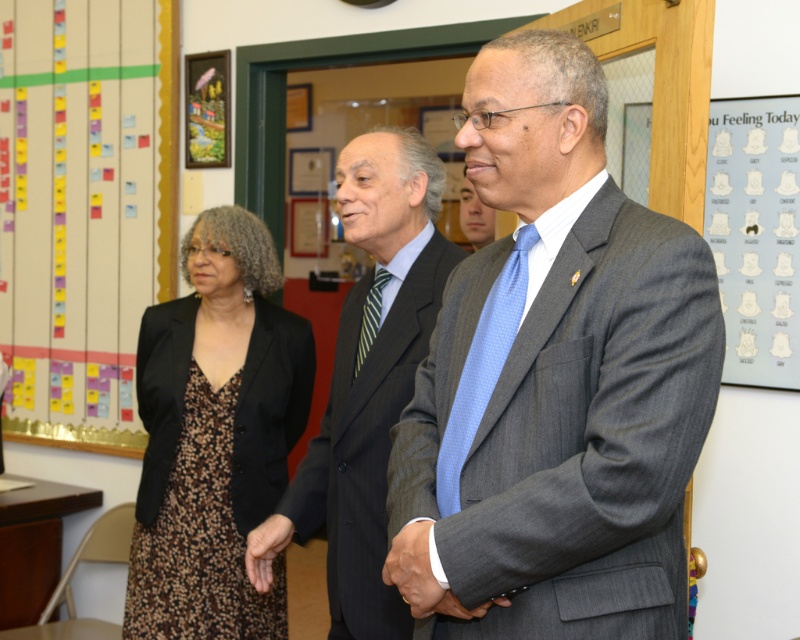
Question: Is gray suit at center to the right of leopard print dress at left from the viewer's perspective?

Choices:
 (A) no
 (B) yes

Answer: (B)

Question: Which point is closer to the camera?

Choices:
 (A) (328, 483)
 (B) (264, 540)
 (C) (376, 300)
 (D) (512, 81)

Answer: (D)

Question: Estimate the real-world distances between objects in this image. Which object is farther from the smooth skin hand at center?

Choices:
 (A) leather textured hand at center
 (B) leopard print dress at left

Answer: (B)

Question: Is gray suit at center above leopard print dress at left?

Choices:
 (A) yes
 (B) no

Answer: (A)

Question: Which object is closer to the camera taking this photo?

Choices:
 (A) green striped tie at center
 (B) smooth skin hand at center
 (C) leather textured hand at center

Answer: (B)

Question: Is leather textured hand at center smaller than green striped tie at center?

Choices:
 (A) yes
 (B) no

Answer: (B)